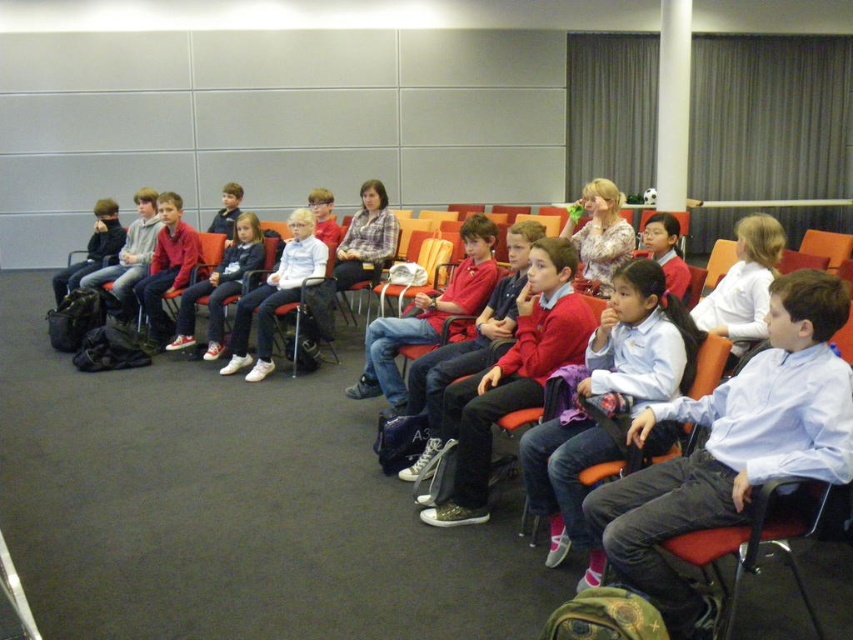
Measure the distance from blue cotton shirt at center to matte red sweater at center.

blue cotton shirt at center is 12.83 inches from matte red sweater at center.

Identify the location of blue cotton shirt at center. (734, 449).

Is matte red sweater at center positioned at the back of white leather jacket at center?

No, matte red sweater at center is closer to the viewer.

What are the coordinates of `matte red sweater at center` in the screenshot? It's located at (637, 344).

Which is behind, point (711, 465) or point (283, 298)?

The point (283, 298) is more distant.

Which of these two, blue cotton shirt at center or white leather jacket at center, stands taller?

Standing taller between the two is white leather jacket at center.

Which is in front, point (846, 394) or point (316, 262)?

Point (846, 394)

The image size is (853, 640). Find the location of `blue cotton shirt at center`. blue cotton shirt at center is located at coordinates (734, 449).